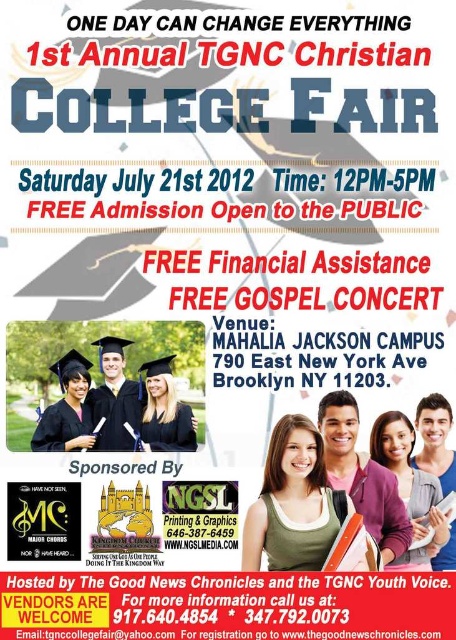
Is matte white graduation gown at center taller than matte black laptop at center?

No.

Locate an element on the screen. The width and height of the screenshot is (456, 640). matte white graduation gown at center is located at coordinates (114, 397).

Does point (105, 380) come in front of point (447, 540)?

Yes.

I want to click on matte white graduation gown at center, so click(114, 397).

Between green fabric shirt at center and matte black hair at center, which one has more height?

Standing taller between the two is matte black hair at center.

Identify the location of green fabric shirt at center. (293, 502).

Can you confirm if matte white graduation gown at center is taller than matte black graduation cap at upper left?

No, matte white graduation gown at center is not taller than matte black graduation cap at upper left.

Is point (124, 417) less distant than point (68, 420)?

No, (124, 417) is further to viewer.

This screenshot has width=456, height=640. I want to click on matte white graduation gown at center, so click(x=114, y=397).